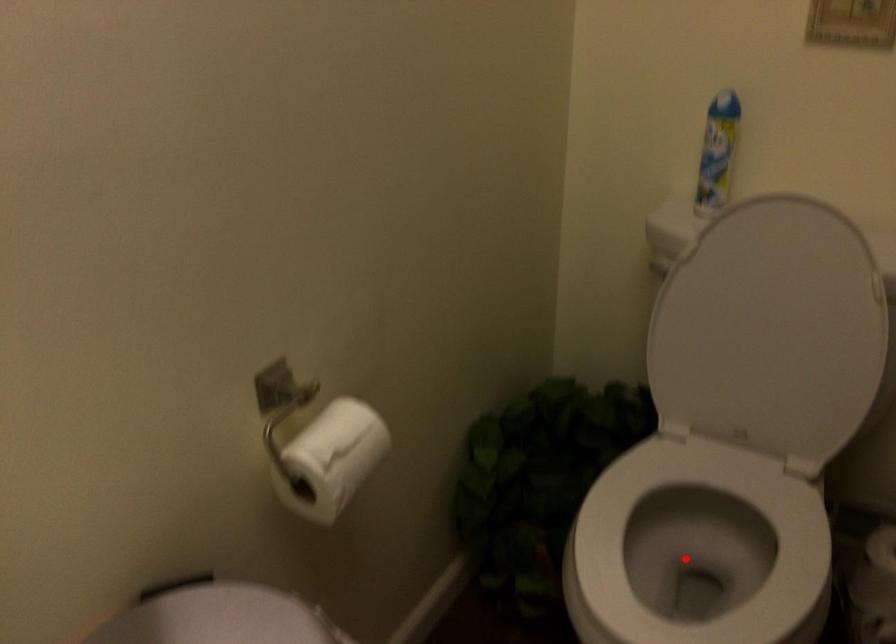
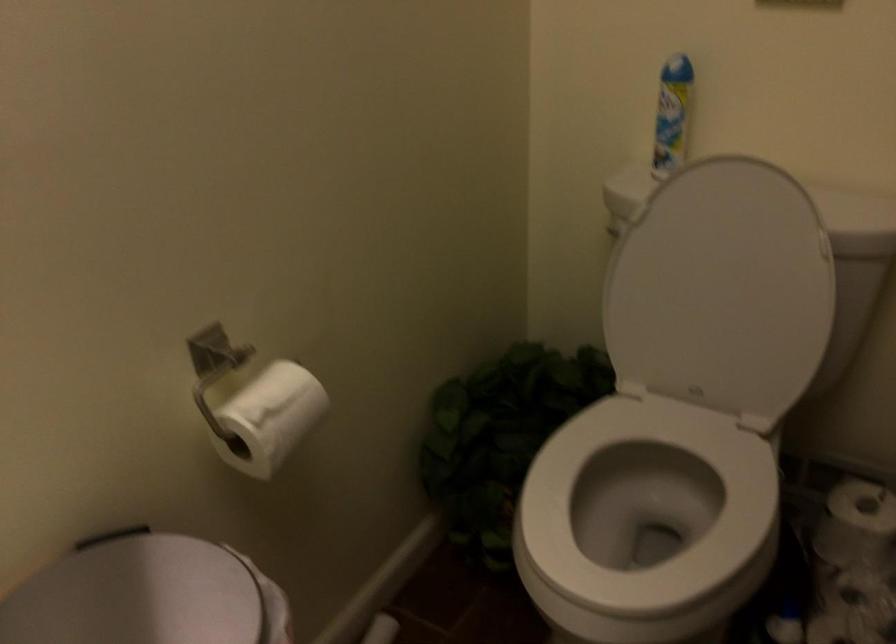
Locate, in the second image, the point that corresponds to the highlighted location in the first image.

(645, 516)